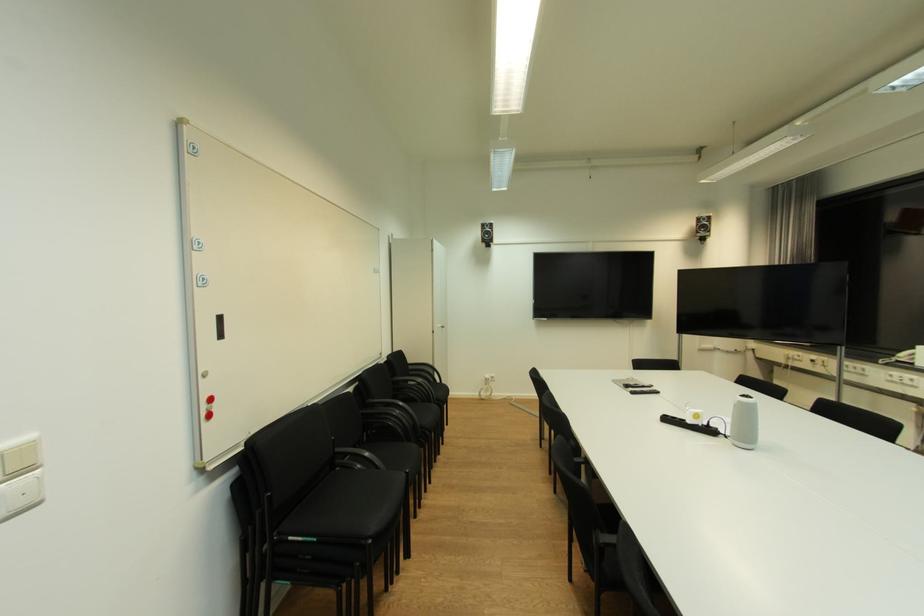
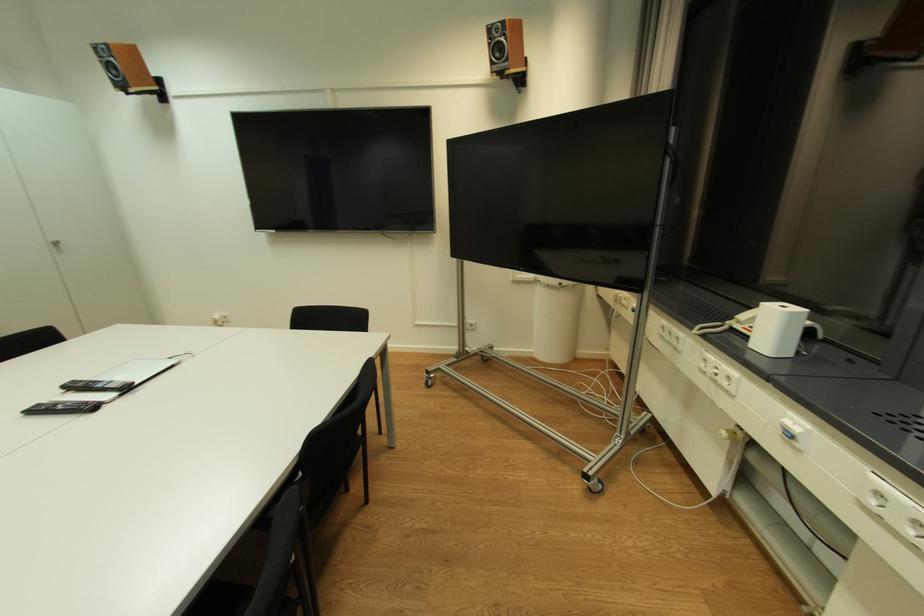
The point at (x=446, y=329) is marked in the first image. Where is the corresponding point in the second image?

(57, 246)